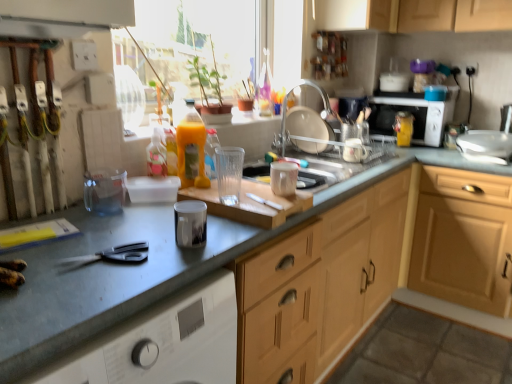
Where is `vacant space to the left of shiny metallic cup at center, the 1th appliance from the left`? The width and height of the screenshot is (512, 384). vacant space to the left of shiny metallic cup at center, the 1th appliance from the left is located at coordinates (128, 231).